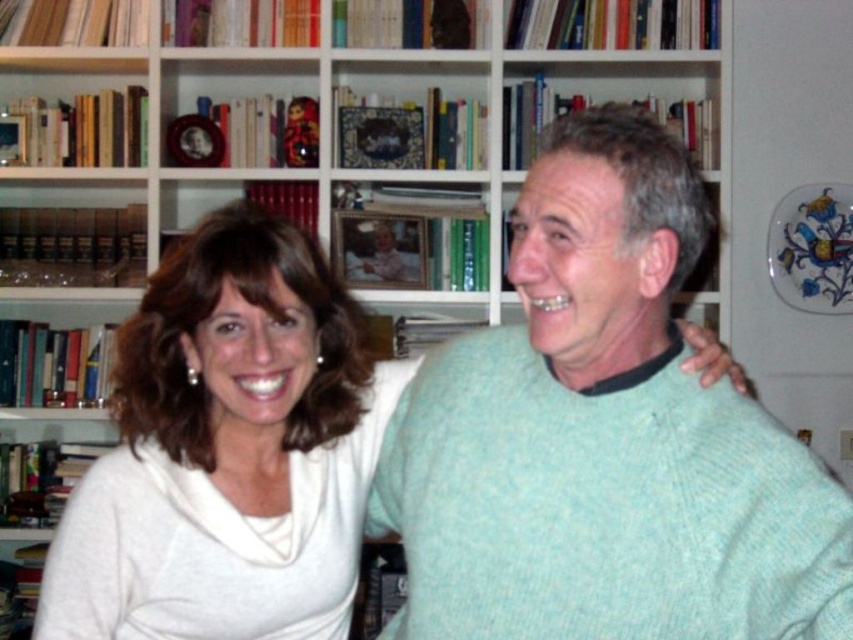
You are a tailor measuring the distance between two sweaters in the image. The light green knitted sweater at center and the white soft sweater at left are part of your inventory. Can you fit both sweaters into a storage box that measures 10 inches in width without overlapping?

The light green knitted sweater at center and the white soft sweater at left are 10.27 inches apart from each other. Since the storage box is only 10 inches wide, the two sweaters cannot fit side by side without overlapping.

You are a photographer standing at a certain distance from the light green knitted sweater at center. You want to take a closeup shot of it. What is the minimum distance you need to move closer to ensure the sweater fills the frame?

The minimum distance you need to move closer is 33.82 inches minus your current distance from the light green knitted sweater at center. However, since the exact current distance isn